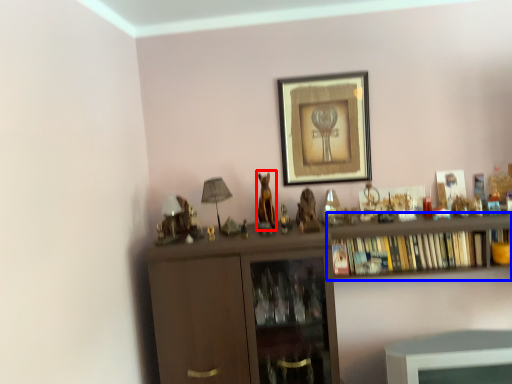
Question: Which object is further to the camera taking this photo, animal (highlighted by a red box) or shelf (highlighted by a blue box)?

Choices:
 (A) animal
 (B) shelf

Answer: (A)